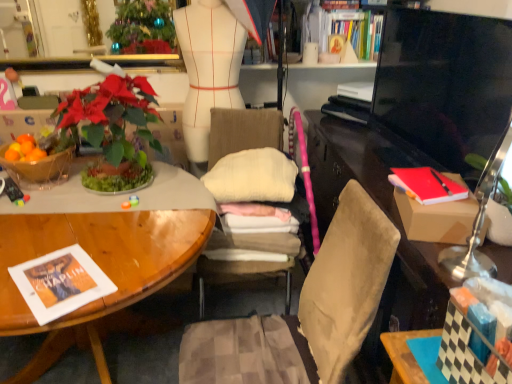
Question: Is matte brown desk at right looking in the opposite direction of metallic gold mirror at upper center?

Choices:
 (A) no
 (B) yes

Answer: (A)

Question: Does matte brown desk at right turn towards metallic gold mirror at upper center?

Choices:
 (A) yes
 (B) no

Answer: (B)

Question: Considering the relative sizes of matte brown desk at right and metallic gold mirror at upper center in the image provided, is matte brown desk at right shorter than metallic gold mirror at upper center?

Choices:
 (A) yes
 (B) no

Answer: (B)

Question: Is matte brown desk at right bigger than metallic gold mirror at upper center?

Choices:
 (A) no
 (B) yes

Answer: (B)

Question: From a real-world perspective, is matte brown desk at right over metallic gold mirror at upper center?

Choices:
 (A) yes
 (B) no

Answer: (B)

Question: Does matte brown desk at right have a lesser width compared to metallic gold mirror at upper center?

Choices:
 (A) yes
 (B) no

Answer: (B)

Question: From the image's perspective, does red matte book at right appear lower than metallic gold mirror at upper center?

Choices:
 (A) no
 (B) yes

Answer: (B)

Question: Could metallic gold mirror at upper center be considered to be inside red matte book at right?

Choices:
 (A) no
 (B) yes

Answer: (A)

Question: Can you confirm if red matte book at right is taller than metallic gold mirror at upper center?

Choices:
 (A) yes
 (B) no

Answer: (B)

Question: Does red matte book at right have a smaller size compared to metallic gold mirror at upper center?

Choices:
 (A) yes
 (B) no

Answer: (A)

Question: Is red matte book at right wider than metallic gold mirror at upper center?

Choices:
 (A) yes
 (B) no

Answer: (A)

Question: From the image's perspective, is red matte book at right above metallic gold mirror at upper center?

Choices:
 (A) no
 (B) yes

Answer: (A)

Question: Could you tell me if metallic gold mirror at upper center is facing matte brown desk at right?

Choices:
 (A) yes
 (B) no

Answer: (B)